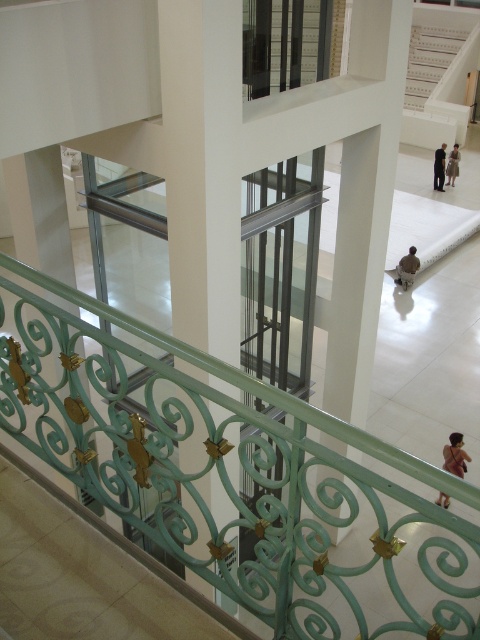
Question: Based on their relative distances, which object is farther from the brown fabric person at center?

Choices:
 (A) white plastic stairs at upper center
 (B) light brown leather jacket at center
 (C) brown fabric at lower right

Answer: (A)

Question: Which object appears farthest from the camera in this image?

Choices:
 (A) white plastic stairs at upper center
 (B) brown fabric person at center

Answer: (A)

Question: Can you confirm if white plastic stairs at upper center is thinner than brown fabric at lower right?

Choices:
 (A) yes
 (B) no

Answer: (B)

Question: Among these objects, which one is nearest to the camera?

Choices:
 (A) brown fabric person at center
 (B) white plastic stairs at upper center

Answer: (A)

Question: Is brown fabric at lower right to the left of brown fabric person at center from the viewer's perspective?

Choices:
 (A) yes
 (B) no

Answer: (A)

Question: Does black fabric person at center have a larger size compared to light brown leather jacket at center?

Choices:
 (A) no
 (B) yes

Answer: (B)